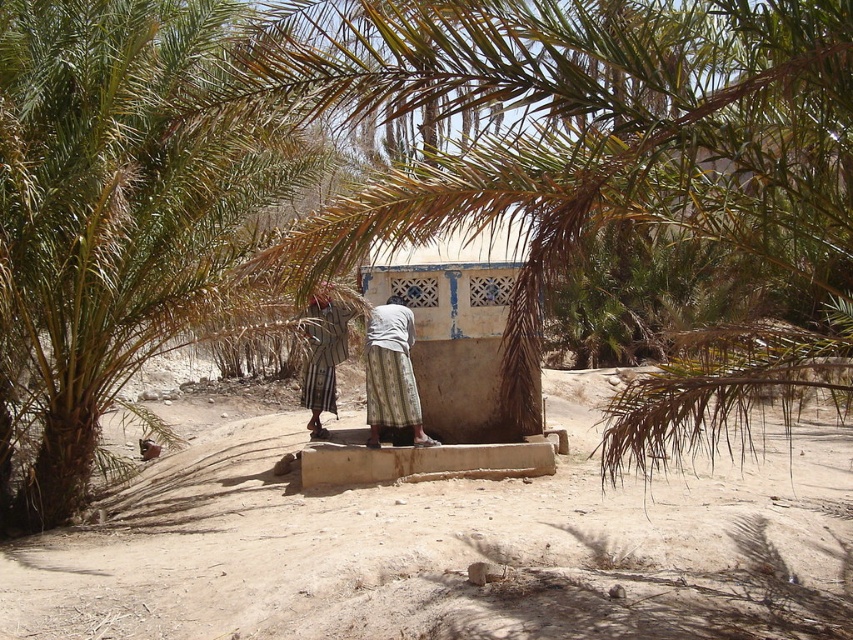
Does green leafy palm tree at left appear on the left side of white textured dress at center?

Yes, green leafy palm tree at left is to the left of white textured dress at center.

The image size is (853, 640). What do you see at coordinates (114, 211) in the screenshot?
I see `green leafy palm tree at left` at bounding box center [114, 211].

Identify the location of green leafy palm tree at left. The image size is (853, 640). (114, 211).

Can you confirm if dusty sand at center is wider than white textured dress at center?

Yes.

Is dusty sand at center positioned in front of white textured dress at center?

Yes, dusty sand at center is closer to the viewer.

Identify the location of dusty sand at center. (448, 548).

Where is `dusty sand at center`? dusty sand at center is located at coordinates (448, 548).

Does point (424, 564) come in front of point (373, 333)?

Yes, point (424, 564) is closer to viewer.

Which is more to the right, dusty sand at center or printed fabric skirt at center?

From the viewer's perspective, dusty sand at center appears more on the right side.

At what (x,y) coordinates should I click in order to perform the action: click on dusty sand at center. Please return your answer as a coordinate pair (x, y). Looking at the image, I should click on (448, 548).